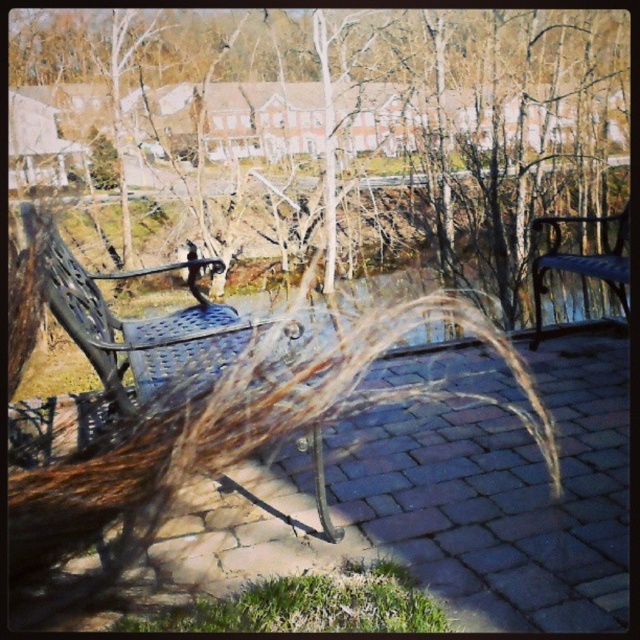
Question: Which of the following is the farthest from the observer?

Choices:
 (A) (61, 323)
 (B) (538, 276)

Answer: (B)

Question: Based on their relative distances, which object is farther from the metallic blue bench at right?

Choices:
 (A) metallic blue bench at center
 (B) brown textured grass at center

Answer: (B)

Question: Is metallic blue bench at center to the right of metallic blue bench at right from the viewer's perspective?

Choices:
 (A) yes
 (B) no

Answer: (B)

Question: Is metallic blue bench at center thinner than metallic blue bench at right?

Choices:
 (A) yes
 (B) no

Answer: (B)

Question: Is brown textured grass at center positioned in front of metallic blue bench at center?

Choices:
 (A) yes
 (B) no

Answer: (B)

Question: Which of the following is the farthest from the observer?

Choices:
 (A) metallic blue bench at center
 (B) brown textured grass at center

Answer: (B)